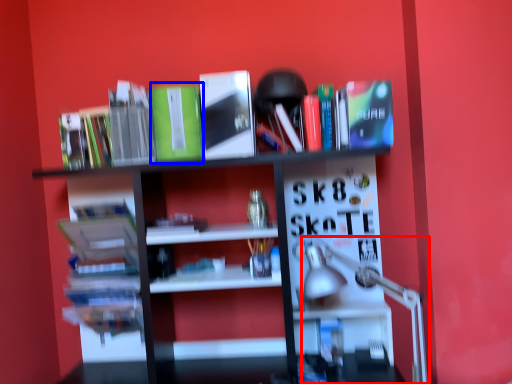
Question: Which point is further to the camera, table lamp (highlighted by a red box) or paperback book (highlighted by a blue box)?

Choices:
 (A) table lamp
 (B) paperback book

Answer: (B)